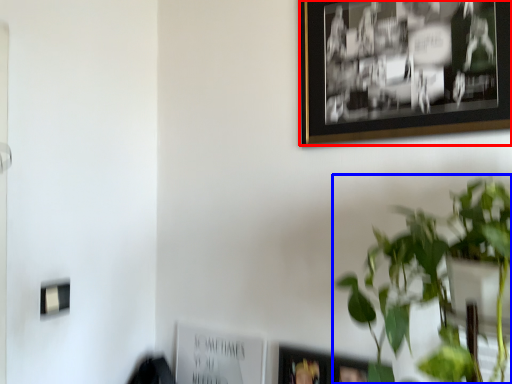
Question: Among these objects, which one is farthest to the camera, picture frame (highlighted by a red box) or houseplant (highlighted by a blue box)?

Choices:
 (A) picture frame
 (B) houseplant

Answer: (A)